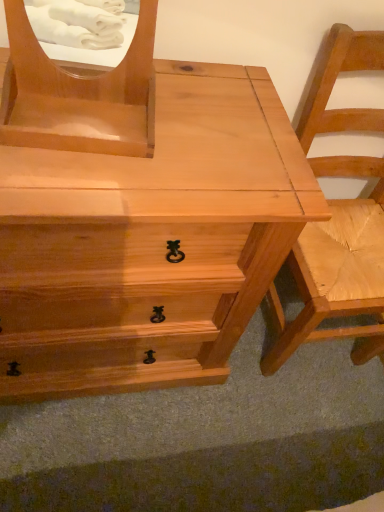
Where is `free location to the right of matte wood mirror at upper left`? free location to the right of matte wood mirror at upper left is located at coordinates (190, 153).